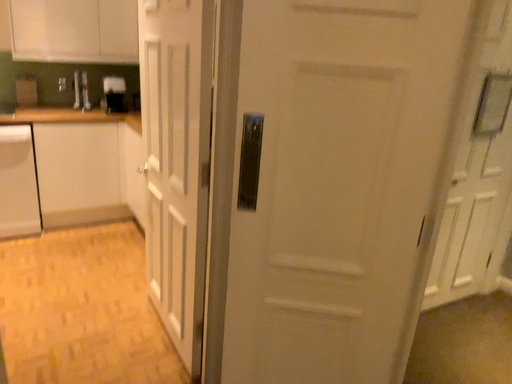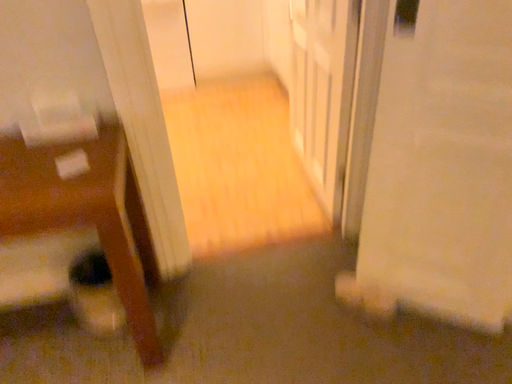
Question: Which way did the camera rotate in the video?

Choices:
 (A) rotated left
 (B) rotated right

Answer: (A)